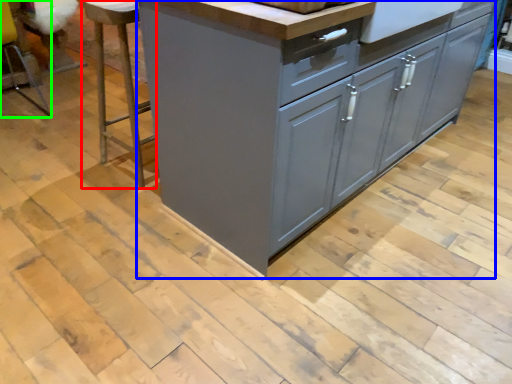
Question: Which object is positioned closest to bar stool (highlighted by a red box)? Select from chest of drawers (highlighted by a blue box) and bar stool (highlighted by a green box).

Choices:
 (A) chest of drawers
 (B) bar stool

Answer: (A)